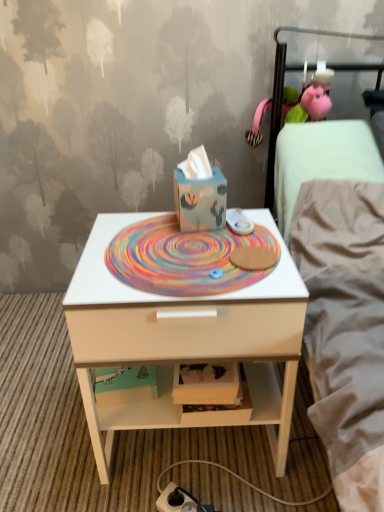
What do you see at coordinates (185, 339) in the screenshot? I see `white matte nightstand at center` at bounding box center [185, 339].

The image size is (384, 512). What do you see at coordinates (200, 201) in the screenshot?
I see `matte blue cardboard box at center` at bounding box center [200, 201].

Measure the distance between point (364, 64) and camera.

4.42 feet.

Describe the element at coordinates (183, 258) in the screenshot. I see `multicolored woven mat at center` at that location.

Measure the distance between point [173,492] and camera.

The depth of point [173,492] is 39.09 inches.

At what (x,y) coordinates should I click in order to perform the action: click on white matte nightstand at center. Please return your answer as a coordinate pair (x, y). The width and height of the screenshot is (384, 512). Looking at the image, I should click on (185, 339).

Consider the image. From a real-world perspective, is multicolored woven mat at center over matte blue cardboard box at center?

No, from a real-world perspective, multicolored woven mat at center is not over matte blue cardboard box at center

Is multicolored woven mat at center touching matte blue cardboard box at center?

There is a gap between multicolored woven mat at center and matte blue cardboard box at center.

Considering the relative sizes of multicolored woven mat at center and matte blue cardboard box at center in the image provided, is multicolored woven mat at center taller than matte blue cardboard box at center?

In fact, multicolored woven mat at center may be shorter than matte blue cardboard box at center.

Considering the positions of objects multicolored woven mat at center and matte blue cardboard box at center in the image provided, who is more to the right, multicolored woven mat at center or matte blue cardboard box at center?

Positioned to the right is matte blue cardboard box at center.

From the image's perspective, is white plastic charger at lower center located beneath white matte nightstand at center?

Yes, from the image's perspective, white plastic charger at lower center is below white matte nightstand at center.

Between white plastic charger at lower center and white matte nightstand at center, which one has smaller size?

white plastic charger at lower center.

Does white plastic charger at lower center contain white matte nightstand at center?

No, white matte nightstand at center is not surrounded by white plastic charger at lower center.

Between white plastic charger at lower center and white matte nightstand at center, which one has less height?

With less height is white plastic charger at lower center.

From the image's perspective, is white plastic charger at lower center above or below white fabric bed at upper right?

Clearly, from the image's perspective, white plastic charger at lower center is below white fabric bed at upper right.

Does white plastic charger at lower center appear on the right side of white fabric bed at upper right?

Incorrect, white plastic charger at lower center is not on the right side of white fabric bed at upper right.

Is white plastic charger at lower center taller or shorter than white fabric bed at upper right?

In the image, white plastic charger at lower center appears to be shorter than white fabric bed at upper right.

What are the coordinates of `charger that is on the left side of white fabric bed at upper right` in the screenshot? It's located at (180, 501).

Consider the image. From their relative heights in the image, would you say white matte nightstand at center is taller or shorter than white fabric bed at upper right?

white matte nightstand at center is shorter than white fabric bed at upper right.

Identify the location of bed on the right side of white matte nightstand at center. (282, 93).

Is white matte nightstand at center surrounding white fabric bed at upper right?

Definitely not — white fabric bed at upper right is not inside white matte nightstand at center.

Is white matte nightstand at center next to white fabric bed at upper right?

No, white matte nightstand at center is not beside white fabric bed at upper right.

Which object is further away from the camera, multicolored woven mat at center or white matte nightstand at center?

multicolored woven mat at center is behind.

Who is taller, multicolored woven mat at center or white matte nightstand at center?

white matte nightstand at center.

Could you tell me if multicolored woven mat at center is facing white matte nightstand at center?

Yes, multicolored woven mat at center is oriented towards white matte nightstand at center.

From a real-world perspective, who is located higher, multicolored woven mat at center or white matte nightstand at center?

multicolored woven mat at center.

Is white plastic charger at lower center facing away from multicolored woven mat at center?

That's not correct — white plastic charger at lower center is not looking away from multicolored woven mat at center.

Is white plastic charger at lower center thinner than multicolored woven mat at center?

Yes, white plastic charger at lower center is thinner than multicolored woven mat at center.

Is point (180, 500) positioned in front of point (221, 260)?

No, it is behind (221, 260).

Would you consider white plastic charger at lower center to be distant from multicolored woven mat at center?

That's not correct — white plastic charger at lower center is a little close to multicolored woven mat at center.

This screenshot has width=384, height=512. I want to click on cardboard box lying above the white plastic charger at lower center (from the image's perspective), so click(x=200, y=201).

Considering the relative sizes of white plastic charger at lower center and matte blue cardboard box at center in the image provided, is white plastic charger at lower center shorter than matte blue cardboard box at center?

Correct, white plastic charger at lower center is not as tall as matte blue cardboard box at center.

Is point (193, 509) in front of point (221, 203)?

That is True.

From the image's perspective, is white plastic charger at lower center located above matte blue cardboard box at center?

No, from the image's perspective, white plastic charger at lower center is not on top of matte blue cardboard box at center.

At what (x,y) coordinates should I click in order to perform the action: click on cardboard box behind the multicolored woven mat at center. Please return your answer as a coordinate pair (x, y). The image size is (384, 512). Looking at the image, I should click on (200, 201).

This screenshot has width=384, height=512. I want to click on nightstand on the left of the white plastic charger at lower center, so click(x=185, y=339).

Which object lies nearer to the anchor point multicolored woven mat at center, white matte nightstand at center or white fabric bed at upper right?

white matte nightstand at center is positioned closer to the anchor multicolored woven mat at center.

Which object lies nearer to the anchor point matte blue cardboard box at center, multicolored woven mat at center or white matte nightstand at center?

multicolored woven mat at center.

From the image, which object appears to be farther from white matte nightstand at center, multicolored woven mat at center or matte blue cardboard box at center?

The object further to white matte nightstand at center is matte blue cardboard box at center.

Based on their spatial positions, is white matte nightstand at center or white plastic charger at lower center further from matte blue cardboard box at center?

Based on the image, white plastic charger at lower center appears to be further to matte blue cardboard box at center.

Considering their positions, is matte blue cardboard box at center positioned closer to white matte nightstand at center than white fabric bed at upper right?

matte blue cardboard box at center.

Looking at the image, which one is located closer to matte blue cardboard box at center, white plastic charger at lower center or white fabric bed at upper right?

Based on the image, white fabric bed at upper right appears to be nearer to matte blue cardboard box at center.

Considering their positions, is multicolored woven mat at center positioned closer to white plastic charger at lower center than white matte nightstand at center?

white matte nightstand at center lies closer to white plastic charger at lower center than the other object.

Estimate the real-world distances between objects in this image. Which object is closer to matte blue cardboard box at center, white fabric bed at upper right or multicolored woven mat at center?

Among the two, multicolored woven mat at center is located nearer to matte blue cardboard box at center.

This screenshot has width=384, height=512. I want to click on nightstand between matte blue cardboard box at center and white plastic charger at lower center vertically, so (185, 339).

The height and width of the screenshot is (512, 384). I want to click on design between white fabric bed at upper right and white plastic charger at lower center in the up-down direction, so click(x=183, y=258).

The image size is (384, 512). What are the coordinates of `nightstand between multicolored woven mat at center and white plastic charger at lower center in the up-down direction` in the screenshot? It's located at (185, 339).

You are a GUI agent. You are given a task and a screenshot of the screen. Output one action in this format:
    pyautogui.click(x=<x>, y=<y>)
    Task: Click on the design between white matte nightstand at center and white fabric bed at upper right
    This screenshot has height=512, width=384.
    Given the screenshot: What is the action you would take?
    pyautogui.click(x=183, y=258)